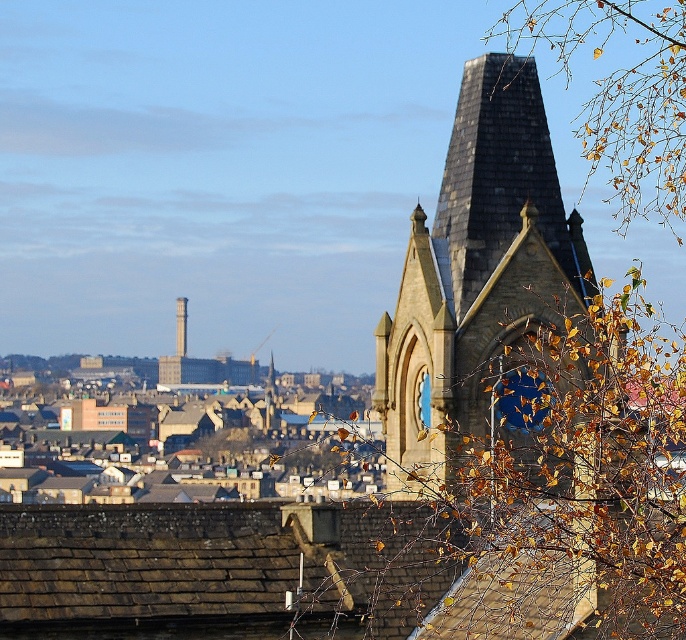
Who is positioned more to the left, golden leafy branch at upper right or blue glass clock at upper center?

blue glass clock at upper center is more to the left.

Is golden leafy branch at upper right taller than blue glass clock at upper center?

Correct, golden leafy branch at upper right is much taller as blue glass clock at upper center.

Which is in front, point (580, 420) or point (427, 374)?

Point (580, 420) is more forward.

Image resolution: width=686 pixels, height=640 pixels. I want to click on golden leafy branch at upper right, so click(532, 403).

Which is above, brown stone tower at center or blue glass clock at upper center?

Positioned higher is brown stone tower at center.

Is brown stone tower at center positioned behind blue glass clock at upper center?

No, it is not.

Measure the distance between brown stone tower at center and camera.

The distance of brown stone tower at center from camera is 81.30 meters.

What are the coordinates of `brown stone tower at center` in the screenshot? It's located at (475, 268).

Where is `golden leafy branch at upper right`? The width and height of the screenshot is (686, 640). golden leafy branch at upper right is located at coordinates (532, 403).

Can you confirm if golden leafy branch at upper right is positioned above brown stone tower at center?

Yes, golden leafy branch at upper right is above brown stone tower at center.

Is point (650, 566) closer to viewer compared to point (414, 454)?

Yes.

Find the location of a particular element. This screenshot has width=686, height=640. golden leafy branch at upper right is located at coordinates (532, 403).